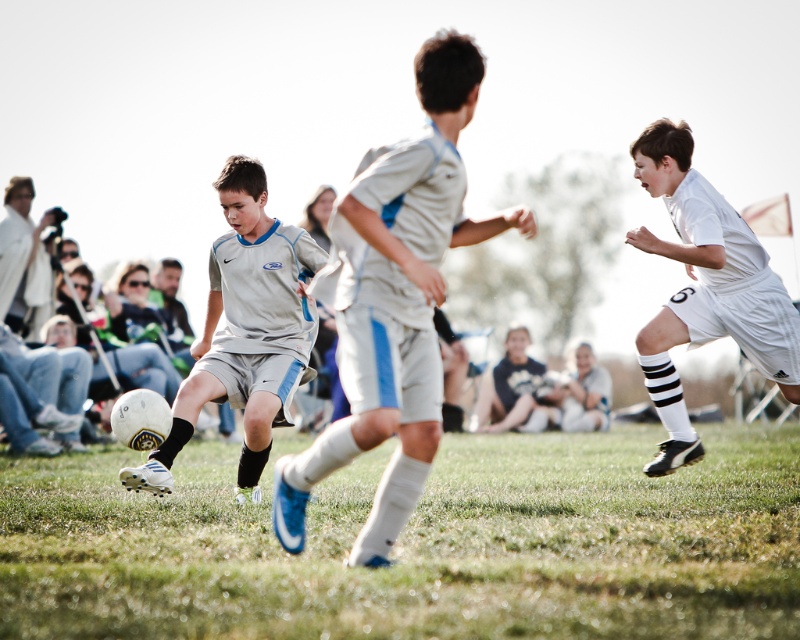
You are a referee observing the soccer match. You need to determine if the light gray uniform at center and the dark blue jersey at center are overlapping in the image. Based on their sizes, can you tell which one is more likely to be in front?

The light gray uniform at center is larger in width than the dark blue jersey at center, so it is more likely to be in front.

Looking at this image, based on the scene description, can you determine if the matte gray shorts at center are wider than the white jersey at center?

The matte gray shorts at center might be wider than white jersey at center according to the description.

You are a photographer standing at the camera position. You want to capture a closeup shot of the matte gray shorts at center. The camera has a minimum focusing distance of 5 meters. Can you take the photo without moving closer?

The matte gray shorts at center is 7.52 meters from camera, which is beyond the minimum focusing distance of 5 meters. Yes, you can take the photo without moving closer.